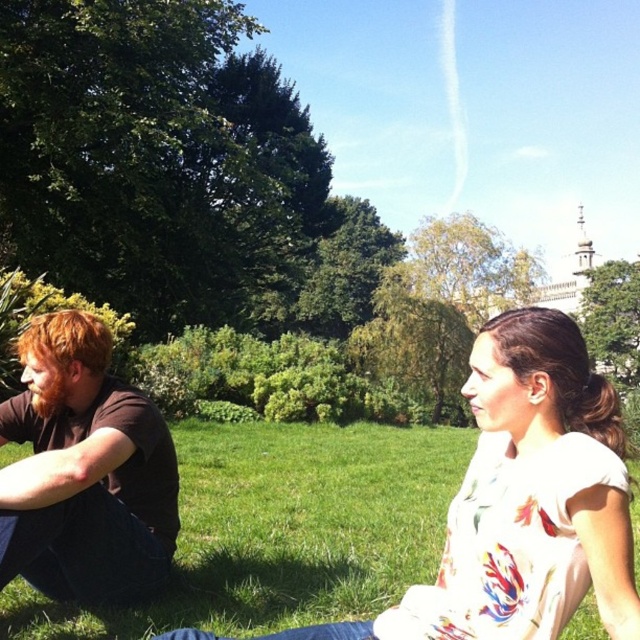
Question: Observing the image, what is the correct spatial positioning of white floral shirt at center in reference to brown cotton shirt at left?

Choices:
 (A) left
 (B) right

Answer: (B)

Question: Does white floral shirt at center appear under brown cotton shirt at left?

Choices:
 (A) yes
 (B) no

Answer: (A)

Question: Can you confirm if white floral shirt at center is bigger than brown cotton shirt at left?

Choices:
 (A) no
 (B) yes

Answer: (A)

Question: Which object appears farthest from the camera in this image?

Choices:
 (A) brown cotton shirt at left
 (B) white floral shirt at center

Answer: (A)

Question: Which point appears closest to the camera in this image?

Choices:
 (A) (68, 513)
 (B) (568, 332)

Answer: (B)